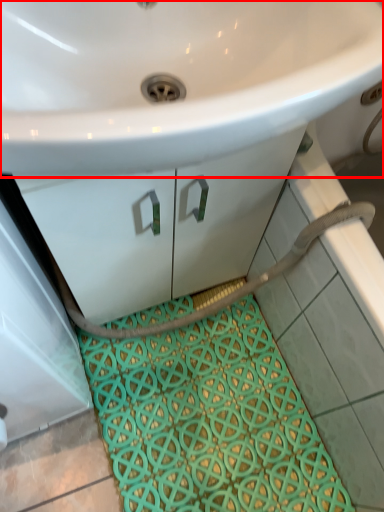
Question: From the image, what is the correct spatial relationship of sink (annotated by the red box) in relation to bath mat?

Choices:
 (A) left
 (B) right

Answer: (A)